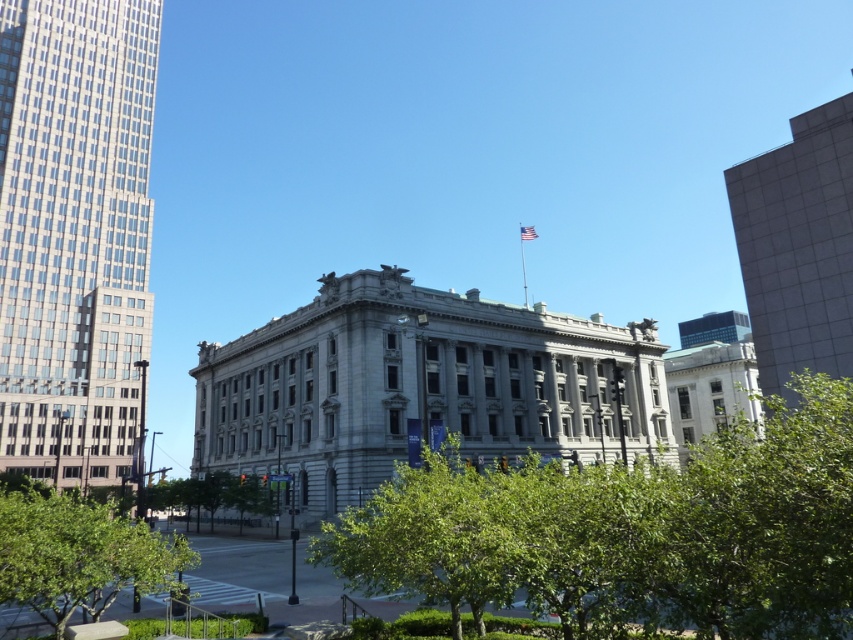
Who is shorter, green leafy tree at lower left or green leafy tree at lower center?

green leafy tree at lower center is shorter.

Who is positioned more to the right, green leafy tree at lower left or green leafy tree at lower center?

green leafy tree at lower center

Between point (112, 509) and point (225, 500), which one is positioned in front?

Point (112, 509) is more forward.

Identify the location of green leafy tree at lower left. (77, 554).

Is point (804, 522) positioned before point (236, 484)?

That is True.

Identify the location of green leafy tree at center. (631, 531).

Identify the location of green leafy tree at center. The image size is (853, 640). (631, 531).

Is point (828, 212) positioned after point (251, 477)?

No, (828, 212) is in front of (251, 477).

Who is more forward, (747, 301) or (195, 493)?

Point (747, 301)

Is point (833, 120) more distant than point (247, 493)?

No, it is not.

In order to click on smooth gray building at right in this screenshot , I will do `click(798, 246)`.